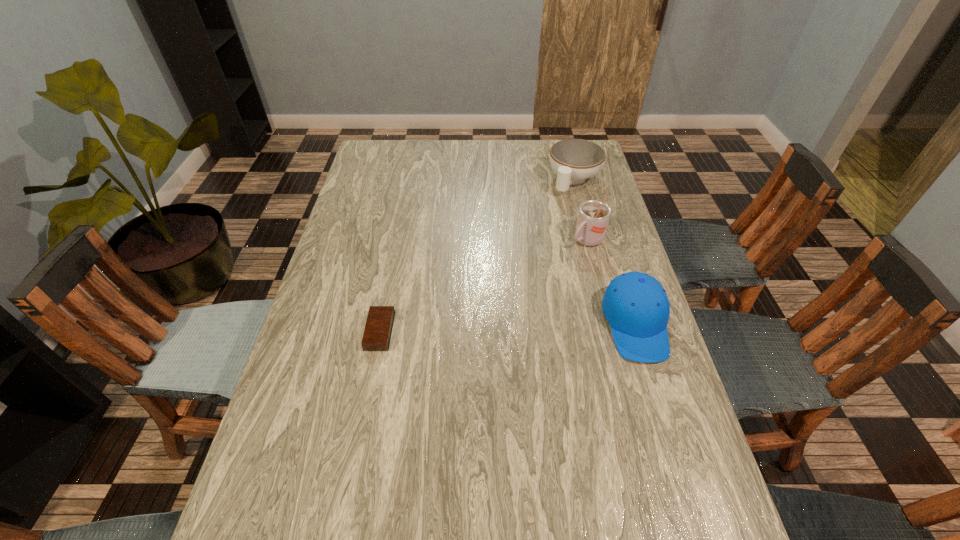
Locate an element on the screen. The width and height of the screenshot is (960, 540). vacant space located 0.080m on the side with the handle of the tallest object is located at coordinates (561, 262).

Where is `free point located 0.370m on the side with the handle of the tallest object`? This screenshot has width=960, height=540. free point located 0.370m on the side with the handle of the tallest object is located at coordinates (494, 316).

Image resolution: width=960 pixels, height=540 pixels. Find the location of `vacant space located on the side with the handle of the tallest object`. vacant space located on the side with the handle of the tallest object is located at coordinates (487, 323).

Locate an element on the screen. This screenshot has height=540, width=960. vacant space located on the side with the handle of the chinaware is located at coordinates (532, 246).

This screenshot has height=540, width=960. Find the location of `free space located 0.230m on the side with the handle of the chinaware`. free space located 0.230m on the side with the handle of the chinaware is located at coordinates (540, 234).

The height and width of the screenshot is (540, 960). Find the location of `vacant space located 0.390m on the side with the handle of the chinaware`. vacant space located 0.390m on the side with the handle of the chinaware is located at coordinates tap(518, 265).

I want to click on object that is at the far edge, so click(x=574, y=160).

This screenshot has height=540, width=960. I want to click on object that is at the left edge, so [x=377, y=334].

This screenshot has width=960, height=540. Identify the location of cap at the right edge. (636, 306).

The width and height of the screenshot is (960, 540). I want to click on cup positioned at the right edge, so click(593, 216).